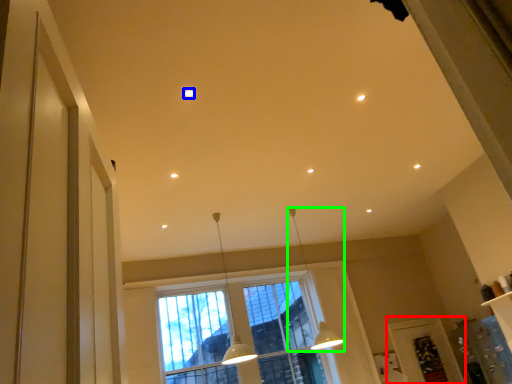
Question: Based on their relative distances, which object is nearer to screen door (highlighted by a red box)? Choose from lighting (highlighted by a blue box) and lamp (highlighted by a green box).

Choices:
 (A) lighting
 (B) lamp

Answer: (B)